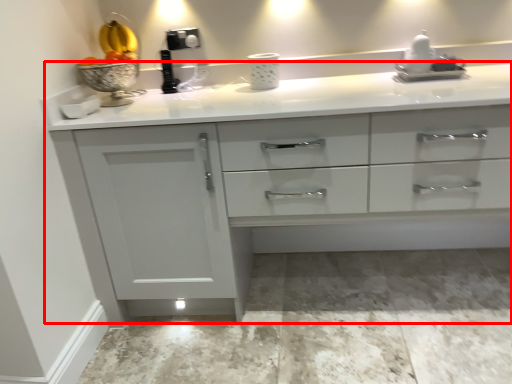
Question: Considering the relative positions of countertop (annotated by the red box) and sink in the image provided, where is countertop (annotated by the red box) located with respect to the staircase?

Choices:
 (A) left
 (B) right

Answer: (A)